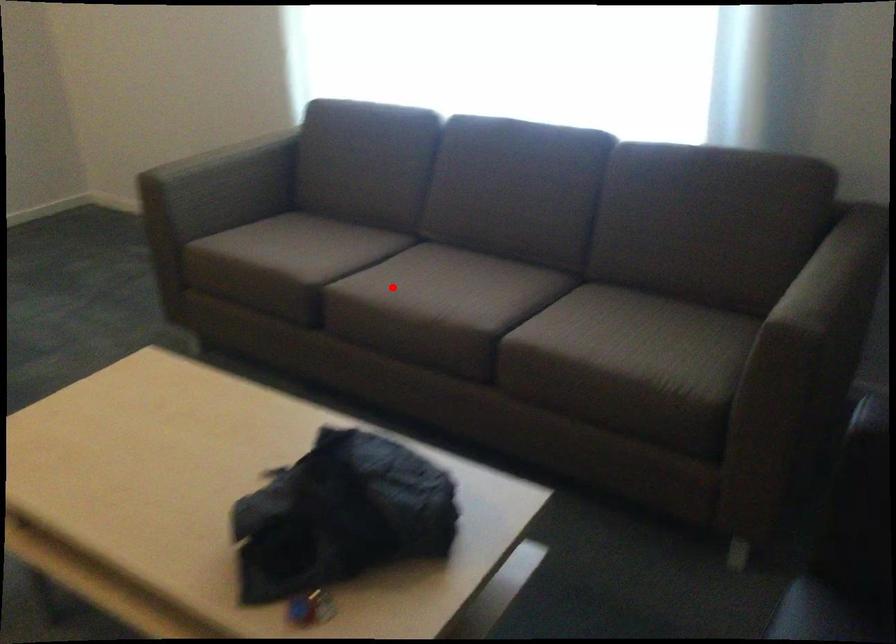
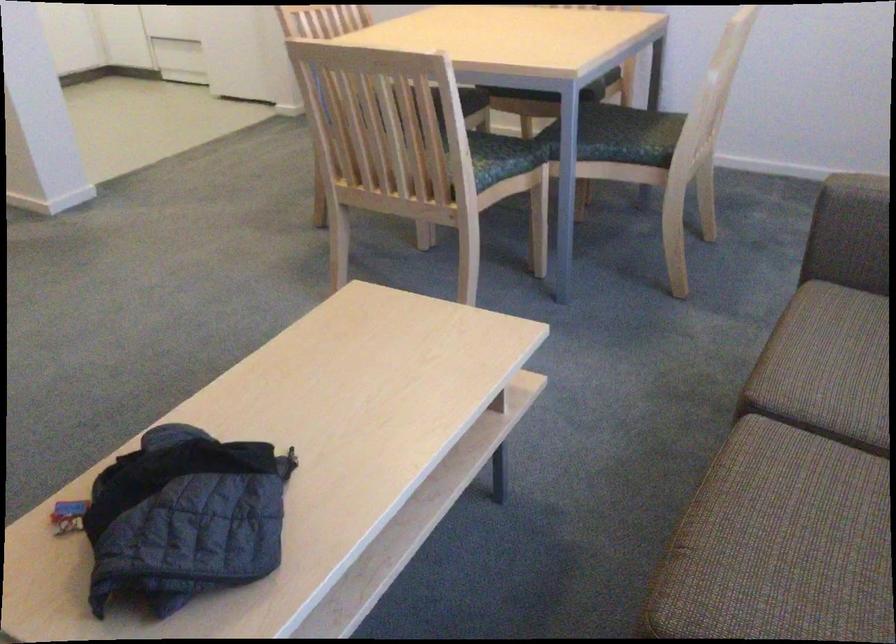
Question: A red point is marked in image1. In image2, is the corresponding 3D point closer to the camera or farther? Reply with the corresponding letter.

Choices:
 (A) The corresponding 3D point is closer.
 (B) The corresponding 3D point is farther.

Answer: (A)